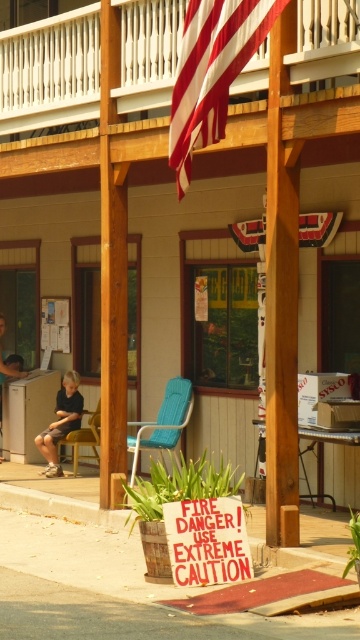
You are planning to set up a small event at the entrance of this building. You have a blue plastic chair at center and dark blue jeans at left. Which object would be more suitable for seating guests?

The blue plastic chair at center is more suitable for seating guests because it has a larger size compared to the dark blue jeans at left, which are likely clothing and not meant for seating.

Consider the image. You are a photographer setting up a tripod in front of the building. You need to place the tripod between the dark brown leather shorts at lower left and the yellow fabric chair at left. Is there enough space for the tripod if it requires a minimum of 1 meter between its legs?

The dark brown leather shorts at lower left is above the yellow fabric chair at left, meaning they are vertically aligned rather than horizontally separated. Since the objects are stacked vertically, there isn not enough horizontal space between them for the tripod to be placed between them with 1 meter required.